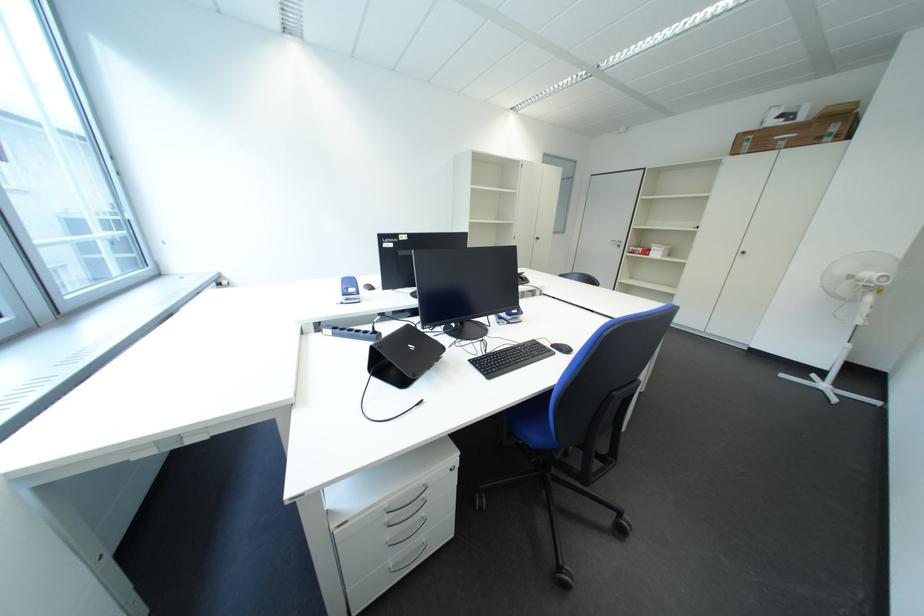
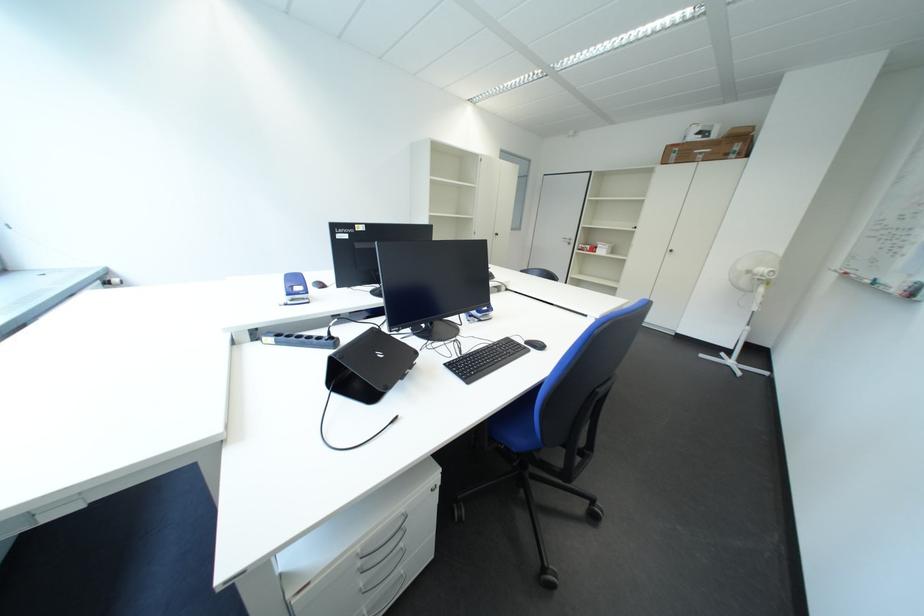
In the second image, find the point that corresponds to point 397,507 in the first image.

(371, 551)